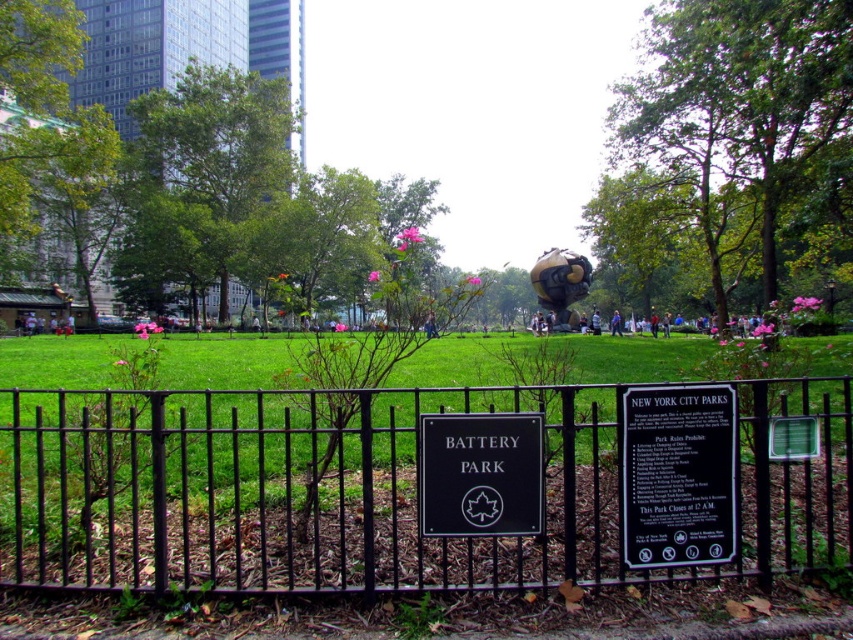
You are a visitor in Battery Park and want to read both the black plastic sign at center and the black polished stone sign at center. Which one should you look at first if you want to read the one that is lower in position?

The black plastic sign at center is below the black polished stone sign at center, so you should look at the black plastic sign at center first since it is lower.

You are a park visitor who wants to read both the black polished stone sign at center and the green matte sign at center. Which sign do you need to look up higher to read?

The black polished stone sign at center is taller than the green matte sign at center, so you need to look up higher to read the black polished stone sign at center.

You are a park visitor trying to read both the black plastic sign at center and the green matte sign at center. Which sign should you stand closer to in order to read them both clearly without moving your position?

The black plastic sign at center might be wider than the green matte sign at center, so you should stand closer to the green matte sign at center to read both clearly without moving.